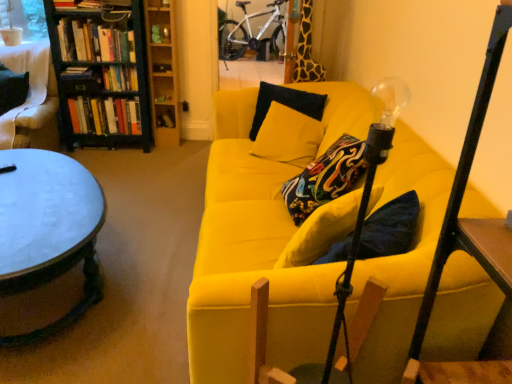
Image resolution: width=512 pixels, height=384 pixels. I want to click on empty space that is to the right of metallic round table at left, so click(157, 262).